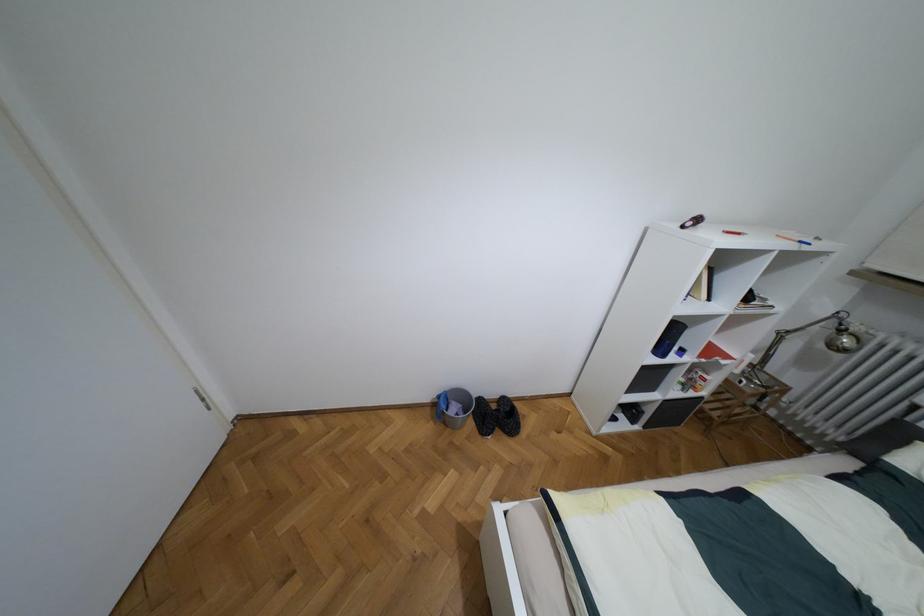
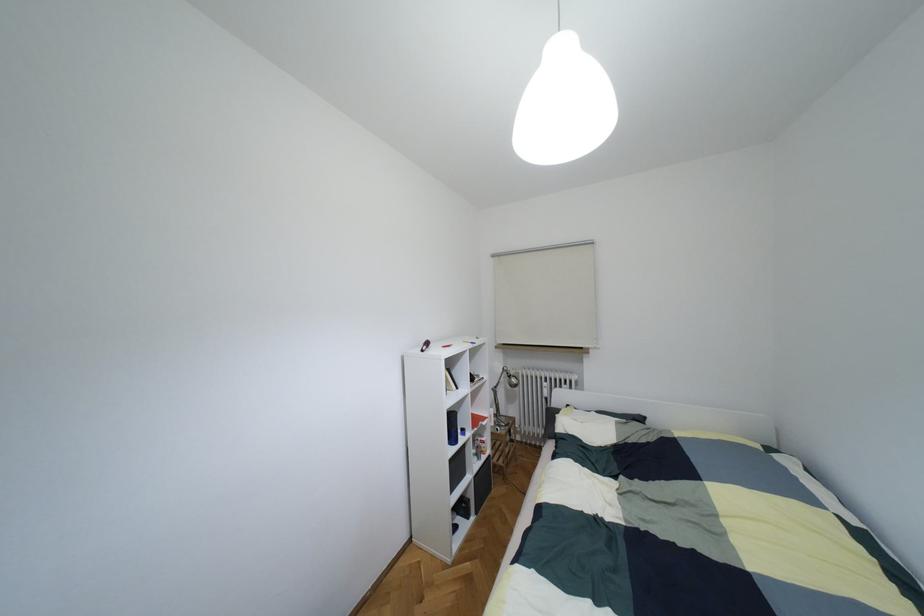
Find the pixel in the second image that matches (x=700, y=411) in the first image.

(493, 464)